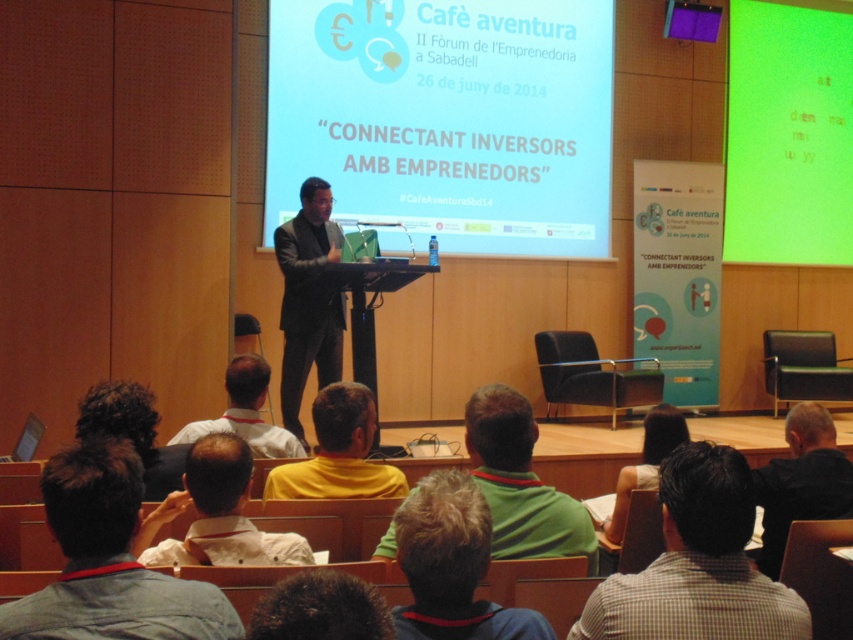
Measure the distance between green shirt at lower center and camera.

green shirt at lower center is 5.34 feet away from camera.

Is green shirt at lower center in front of white shirt at lower center?

Yes, it is.

This screenshot has height=640, width=853. Describe the element at coordinates (698, 564) in the screenshot. I see `green shirt at lower center` at that location.

The height and width of the screenshot is (640, 853). Find the location of `green shirt at lower center`. green shirt at lower center is located at coordinates (698, 564).

Based on the photo, does green matte projection screen at upper right appear on the right side of green shirt at lower center?

Indeed, green matte projection screen at upper right is positioned on the right side of green shirt at lower center.

Is point (790, 204) in front of point (761, 609)?

No, (790, 204) is further to viewer.

Where is `green matte projection screen at upper right`? The width and height of the screenshot is (853, 640). green matte projection screen at upper right is located at coordinates (788, 134).

Who is shorter, green matte projection screen at upper right or dark gray suit at center?

With less height is dark gray suit at center.

Between green matte projection screen at upper right and dark gray suit at center, which one is positioned lower?

dark gray suit at center is below.

I want to click on green matte projection screen at upper right, so click(x=788, y=134).